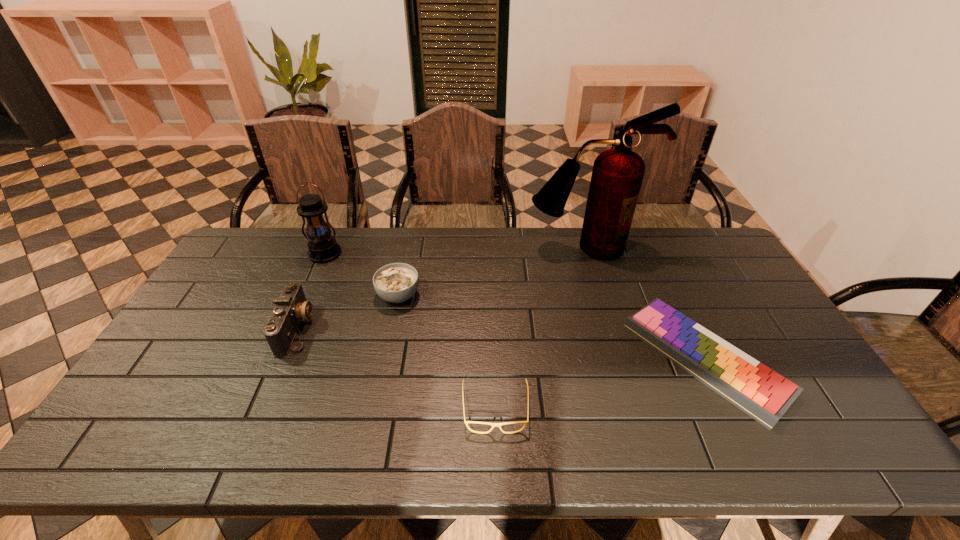
I want to click on vacant space located on the back of the fourth object from right to left, so [409, 242].

Identify the location of blank space located on the back of the computer keyboard. [658, 262].

At what (x,y) coordinates should I click in order to perform the action: click on fire extinguisher located at the far edge. Please return your answer as a coordinate pair (x, y). The height and width of the screenshot is (540, 960). Looking at the image, I should click on (617, 175).

At what (x,y) coordinates should I click in order to perform the action: click on lantern positioned at the far edge. Please return your answer as a coordinate pair (x, y). Looking at the image, I should click on (322, 247).

Where is `computer keyboard present at the near edge`? computer keyboard present at the near edge is located at coordinates pos(762,393).

Identify the location of spectacles at the near edge. (493, 425).

Identify the location of object that is at the right edge. This screenshot has height=540, width=960. (762, 393).

The height and width of the screenshot is (540, 960). What are the coordinates of `object at the near right corner` in the screenshot? It's located at (762, 393).

Locate an element on the screen. The image size is (960, 540). vacant space at the far edge of the desktop is located at coordinates [579, 237].

The image size is (960, 540). Find the location of `vacant space at the near edge of the desktop`. vacant space at the near edge of the desktop is located at coordinates (597, 452).